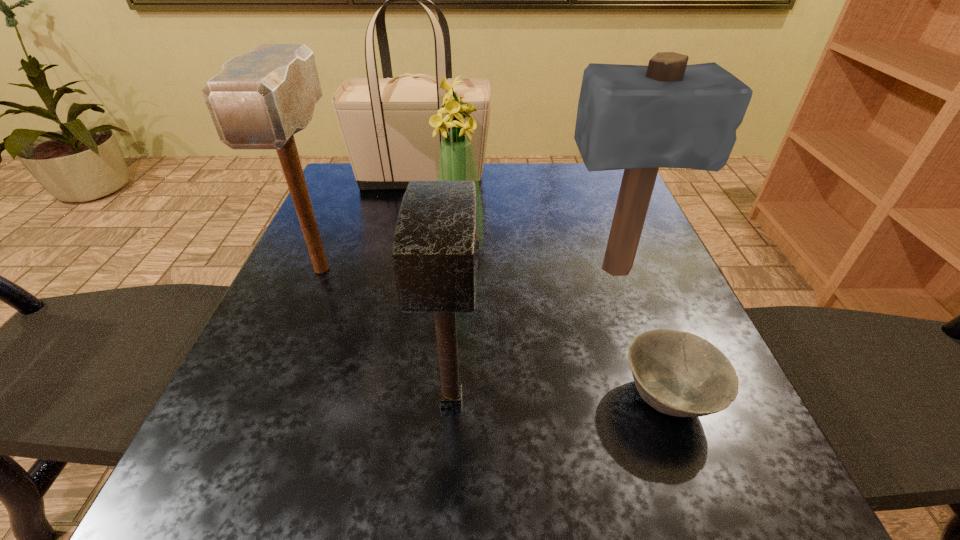
You are a GUI agent. You are given a task and a screenshot of the screen. Output one action in this format:
    pyautogui.click(x=<x>, y=<y>)
    Task: Click on the shopping bag
    
    Given the screenshot: What is the action you would take?
    pyautogui.click(x=384, y=122)

Where is `the rightmost mallet`? the rightmost mallet is located at coordinates (668, 114).

Find the location of a particular element. This screenshot has height=540, width=960. the leftmost mallet is located at coordinates (259, 100).

I want to click on bouquet, so click(457, 162).

The height and width of the screenshot is (540, 960). What are the coordinates of `the second mallet from right to left` in the screenshot? It's located at (435, 250).

What are the coordinates of `the nearest mallet` in the screenshot? It's located at (435, 250).

Where is `the shortest object`? The height and width of the screenshot is (540, 960). the shortest object is located at coordinates (678, 373).

I want to click on vacant space located with handles facing forward on the farthest object, so (626, 178).

At what (x,y) coordinates should I click in order to perform the action: click on free location located 0.330m on the back of the rightmost mallet. Please return your answer as a coordinate pair (x, y). This screenshot has width=960, height=540. Looking at the image, I should click on (581, 175).

Locate an element on the screen. vacant position located on the striking face of the leftmost mallet is located at coordinates (273, 387).